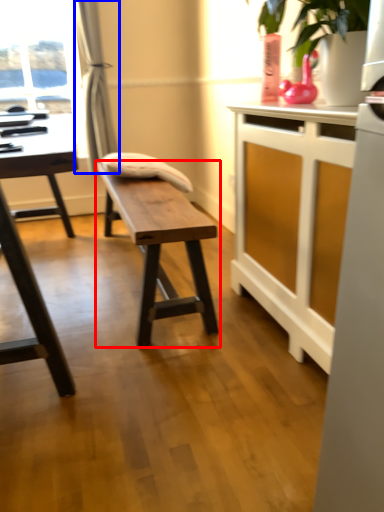
Question: Which object appears farthest to the camera in this image, table (highlighted by a red box) or curtain (highlighted by a blue box)?

Choices:
 (A) table
 (B) curtain

Answer: (B)